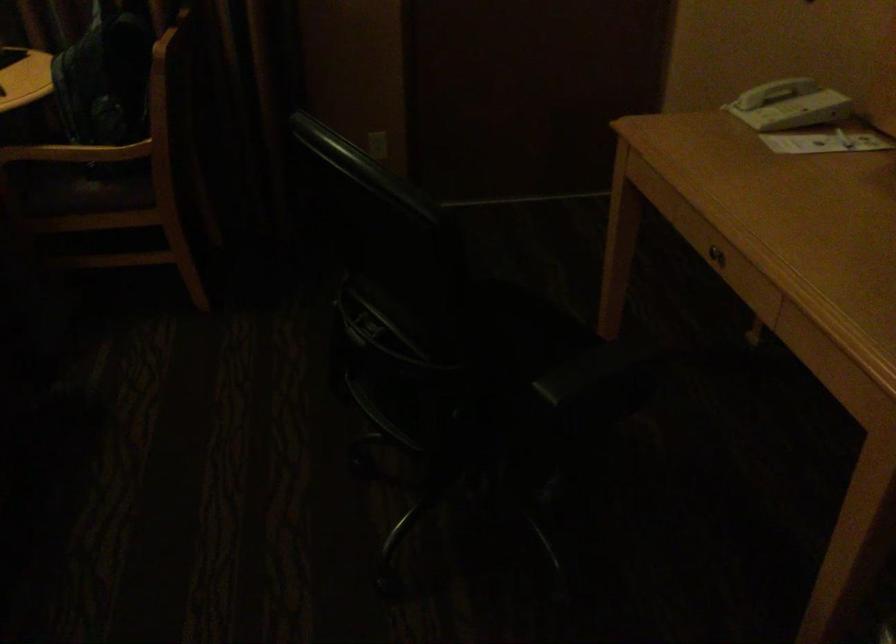
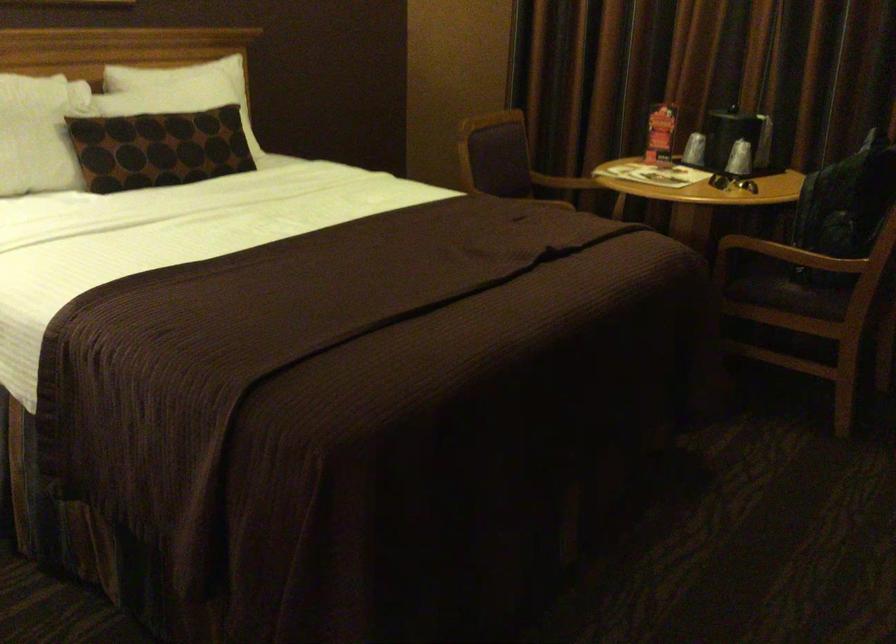
Question: The camera is either moving clockwise (left) or counter-clockwise (right) around the object. The first image is from the beginning of the video and the second image is from the end. Is the camera moving left or right when shooting the video?

Choices:
 (A) Left
 (B) Right

Answer: (B)